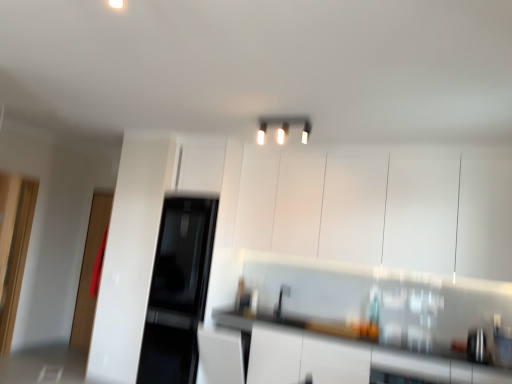
Question: Considering the relative sizes of black glass refrigerator at center, which is the first appliance in back-to-front order, and sleek stainless steel kettle at lower right, marked as the second appliance in a back-to-front arrangement, in the image provided, is black glass refrigerator at center, which is the first appliance in back-to-front order, shorter than sleek stainless steel kettle at lower right, marked as the second appliance in a back-to-front arrangement,?

Choices:
 (A) yes
 (B) no

Answer: (B)

Question: Is black glass refrigerator at center, the 2th appliance positioned from the front, positioned beyond the bounds of sleek stainless steel kettle at lower right, marked as the second appliance in a back-to-front arrangement?

Choices:
 (A) no
 (B) yes

Answer: (B)

Question: Could you tell me if black glass refrigerator at center, arranged as the 2th appliance when viewed from the right, is facing sleek stainless steel kettle at lower right, marked as the second appliance in a back-to-front arrangement?

Choices:
 (A) no
 (B) yes

Answer: (A)

Question: Is black glass refrigerator at center, acting as the 1th appliance starting from the top, further to camera compared to sleek stainless steel kettle at lower right, arranged as the 1th appliance when viewed from the right?

Choices:
 (A) no
 (B) yes

Answer: (B)

Question: From the image's perspective, would you say black glass refrigerator at center, which is the first appliance in back-to-front order, is positioned over sleek stainless steel kettle at lower right, the 2th appliance when ordered from top to bottom?

Choices:
 (A) yes
 (B) no

Answer: (A)

Question: Can you confirm if black glass refrigerator at center, the 2th appliance positioned from the front, is smaller than sleek stainless steel kettle at lower right, marked as the second appliance in a back-to-front arrangement?

Choices:
 (A) yes
 (B) no

Answer: (B)

Question: From a real-world perspective, does transparent glass door at left, the 1th glass door from the back, stand above black glass refrigerator at center, arranged as the 2th appliance when viewed from the right?

Choices:
 (A) no
 (B) yes

Answer: (B)

Question: Is transparent glass door at left, the 1th glass door from the back, surrounding black glass refrigerator at center, the 1th appliance positioned from the left?

Choices:
 (A) no
 (B) yes

Answer: (A)

Question: Considering the relative positions of transparent glass door at left, placed as the 2th glass door when sorted from front to back, and black glass refrigerator at center, the 2th appliance in the bottom-to-top sequence, in the image provided, is transparent glass door at left, placed as the 2th glass door when sorted from front to back, to the right of black glass refrigerator at center, the 2th appliance in the bottom-to-top sequence, from the viewer's perspective?

Choices:
 (A) no
 (B) yes

Answer: (A)

Question: Is transparent glass door at left, the 1th glass door from the back, thinner than black glass refrigerator at center, acting as the 1th appliance starting from the top?

Choices:
 (A) yes
 (B) no

Answer: (A)

Question: Considering the relative positions of transparent glass door at left, the 1th glass door from the back, and black glass refrigerator at center, the 2th appliance in the bottom-to-top sequence, in the image provided, is transparent glass door at left, the 1th glass door from the back, to the left of black glass refrigerator at center, the 2th appliance in the bottom-to-top sequence, from the viewer's perspective?

Choices:
 (A) no
 (B) yes

Answer: (B)

Question: Is transparent glass door at left, placed as the 2th glass door when sorted from front to back, behind black glass refrigerator at center, the 2th appliance positioned from the front?

Choices:
 (A) no
 (B) yes

Answer: (B)

Question: From the image's perspective, is white glossy countertop at lower right located above sleek stainless steel kettle at lower right, arranged as the 1th appliance when viewed from the right?

Choices:
 (A) no
 (B) yes

Answer: (A)